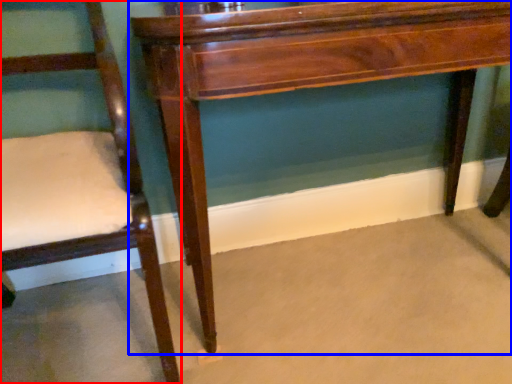
Question: Which object appears farthest to the camera in this image, chair (highlighted by a red box) or table (highlighted by a blue box)?

Choices:
 (A) chair
 (B) table

Answer: (B)